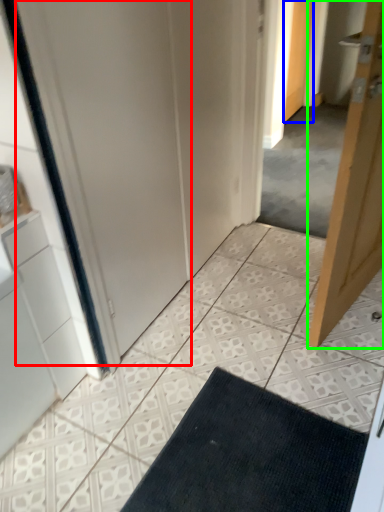
Question: Considering the real-world distances, which object is farthest from screen door (highlighted by a red box)? door (highlighted by a blue box) or door (highlighted by a green box)?

Choices:
 (A) door
 (B) door

Answer: (A)